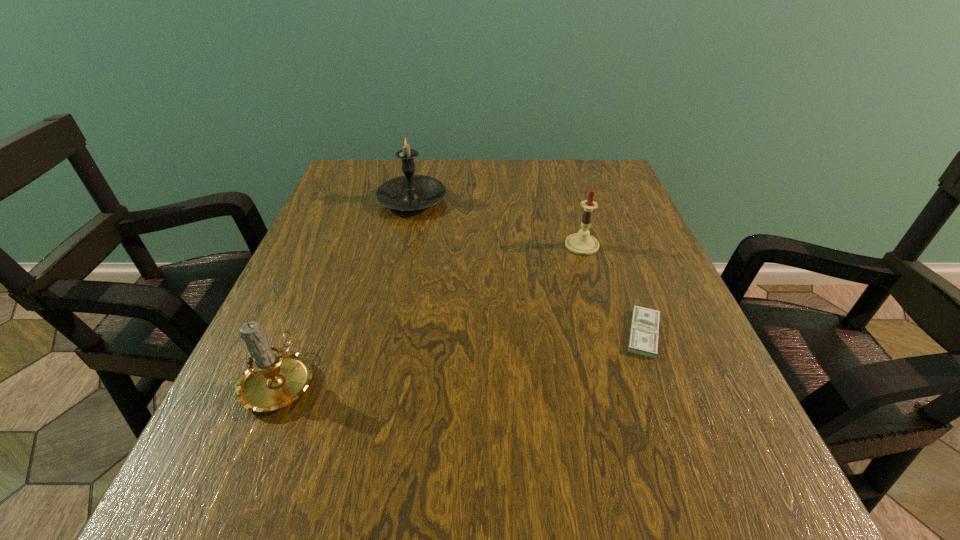
You are a GUI agent. You are given a task and a screenshot of the screen. Output one action in this format:
    pyautogui.click(x=<x>, y=<y>)
    Task: Click on the free space at the far right corner
    The height and width of the screenshot is (540, 960).
    Given the screenshot: What is the action you would take?
    pos(601,200)

Identify the location of vacant region at the near right corner of the desktop. (688, 491).

You are a GUI agent. You are given a task and a screenshot of the screen. Output one action in this format:
    pyautogui.click(x=<x>, y=<y>)
    Task: Click on the empty space between the second farthest object and the leftmost candle
    
    Given the screenshot: What is the action you would take?
    pyautogui.click(x=431, y=313)

What are the coordinates of `free space between the farthest candle and the shortest object` in the screenshot? It's located at (528, 267).

Find the location of a particular element. The width and height of the screenshot is (960, 540). free area in between the leftmost object and the money is located at coordinates (463, 357).

Find the location of a particular element. Image resolution: width=960 pixels, height=540 pixels. free space between the nearest candle and the farthest candle is located at coordinates (347, 290).

Where is `free space that is in between the second nearest candle and the shortest object`? Image resolution: width=960 pixels, height=540 pixels. free space that is in between the second nearest candle and the shortest object is located at coordinates (612, 289).

The image size is (960, 540). What are the coordinates of `vacant area that lies between the shortest object and the second nearest candle` in the screenshot? It's located at (612, 289).

Identify the location of unoccupied position between the leftmost object and the farthest candle. This screenshot has height=540, width=960. (347, 290).

This screenshot has height=540, width=960. What are the coordinates of `vacant space that is in between the second nearest candle and the money` in the screenshot? It's located at (612, 289).